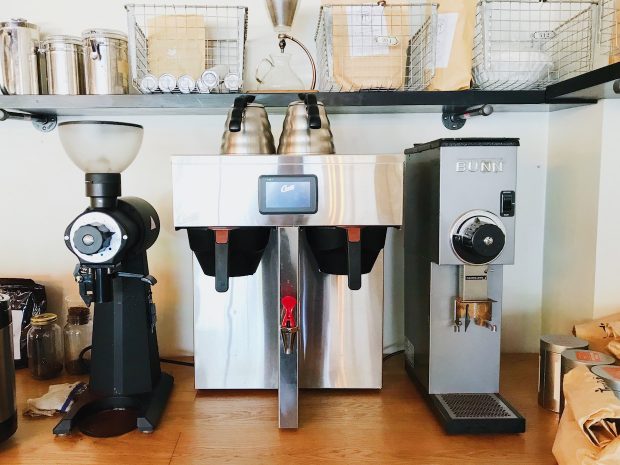
What are the coordinates of `glass jar` in the screenshot? It's located at (43, 352), (77, 332).